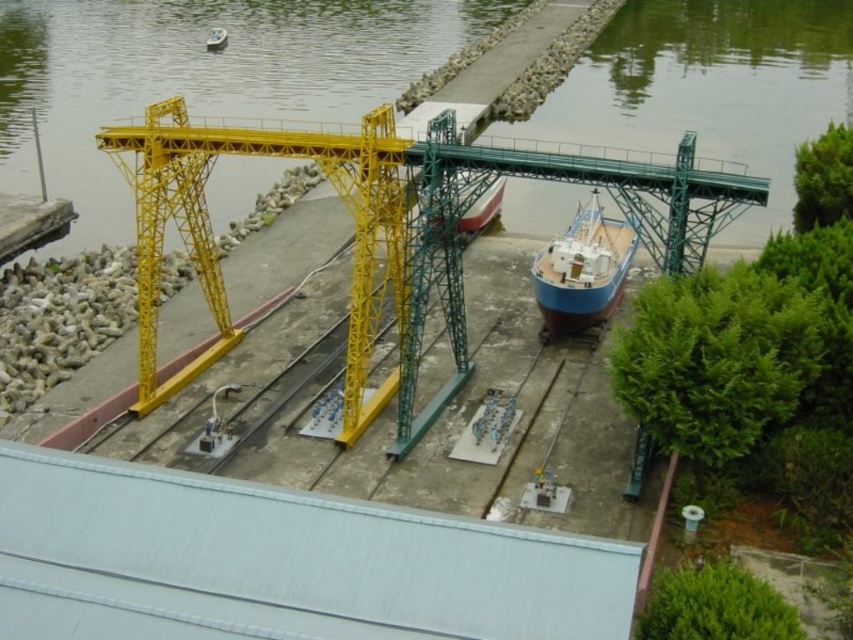
Which is more to the right, transparent water at upper left or yellow metallic gantry crane at center?

Positioned to the right is yellow metallic gantry crane at center.

Is the position of transparent water at upper left less distant than that of yellow metallic gantry crane at center?

That is False.

This screenshot has height=640, width=853. Find the location of `transparent water at upper left`. transparent water at upper left is located at coordinates (199, 76).

You are a GUI agent. You are given a task and a screenshot of the screen. Output one action in this format:
    pyautogui.click(x=<x>, y=<y>)
    Task: Click on the transparent water at upper left
    
    Given the screenshot: What is the action you would take?
    pyautogui.click(x=199, y=76)

Who is taller, blue matte ship at center or blue matte boat at center?

blue matte ship at center

Which is more to the right, blue matte ship at center or blue matte boat at center?

blue matte ship at center is more to the right.

Locate an element on the screen. The image size is (853, 640). blue matte ship at center is located at coordinates (582, 269).

Where is `blue matte ship at center`? The height and width of the screenshot is (640, 853). blue matte ship at center is located at coordinates (582, 269).

Image resolution: width=853 pixels, height=640 pixels. What do you see at coordinates (482, 209) in the screenshot?
I see `blue matte boat at center` at bounding box center [482, 209].

The height and width of the screenshot is (640, 853). Describe the element at coordinates (482, 209) in the screenshot. I see `blue matte boat at center` at that location.

The width and height of the screenshot is (853, 640). Identify the location of blue matte boat at center. (482, 209).